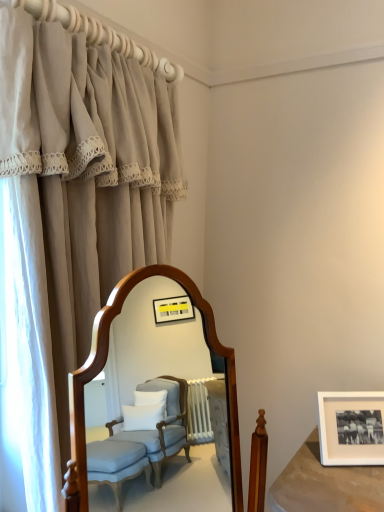
Question: Looking at the image, does white matte picture frame at lower right seem bigger or smaller compared to beige fabric curtain at left?

Choices:
 (A) small
 (B) big

Answer: (A)

Question: Is point (322, 462) positioned closer to the camera than point (57, 327)?

Choices:
 (A) closer
 (B) farther

Answer: (B)

Question: From a real-world perspective, is white matte picture frame at lower right positioned above or below beige fabric curtain at left?

Choices:
 (A) below
 (B) above

Answer: (A)

Question: Considering the positions of beige fabric curtain at left and white matte picture frame at lower right in the image, is beige fabric curtain at left wider or thinner than white matte picture frame at lower right?

Choices:
 (A) thin
 (B) wide

Answer: (B)

Question: Considering the positions of point (125, 98) and point (359, 442), is point (125, 98) closer or farther from the camera than point (359, 442)?

Choices:
 (A) farther
 (B) closer

Answer: (B)

Question: Looking at the image, does beige fabric curtain at left seem bigger or smaller compared to white matte picture frame at lower right?

Choices:
 (A) small
 (B) big

Answer: (B)

Question: From the image's perspective, is beige fabric curtain at left located above or below white matte picture frame at lower right?

Choices:
 (A) below
 (B) above

Answer: (B)